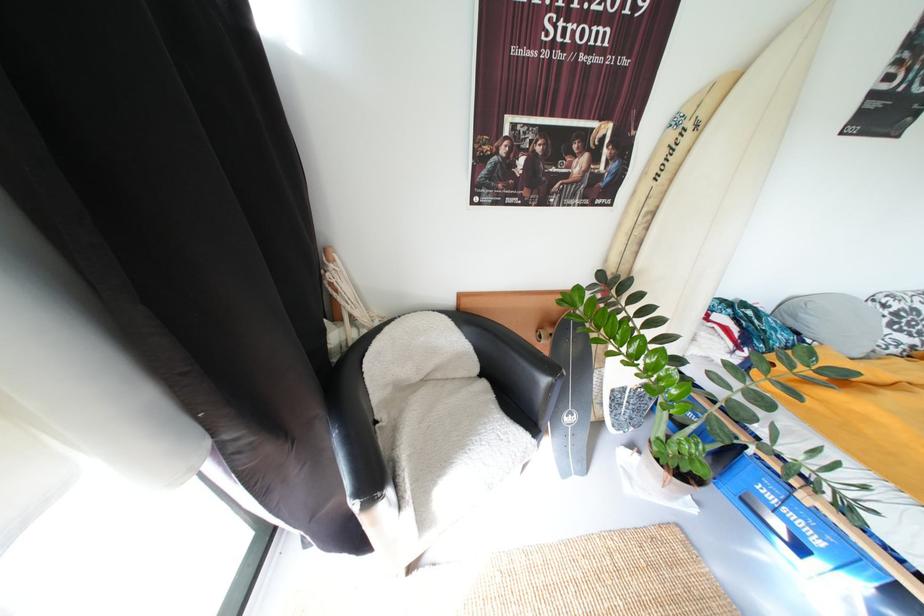
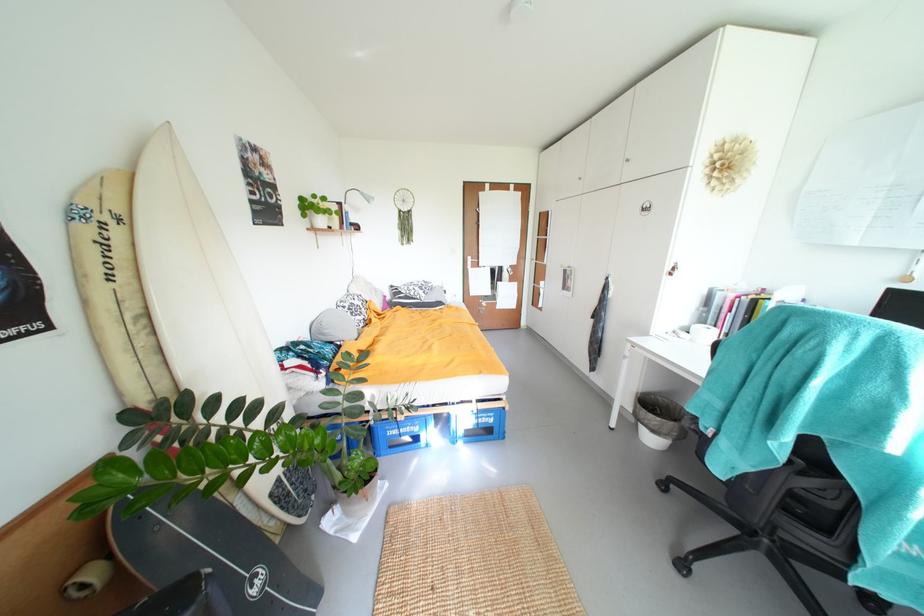
The point at (676, 439) is marked in the first image. Where is the corresponding point in the second image?

(347, 471)